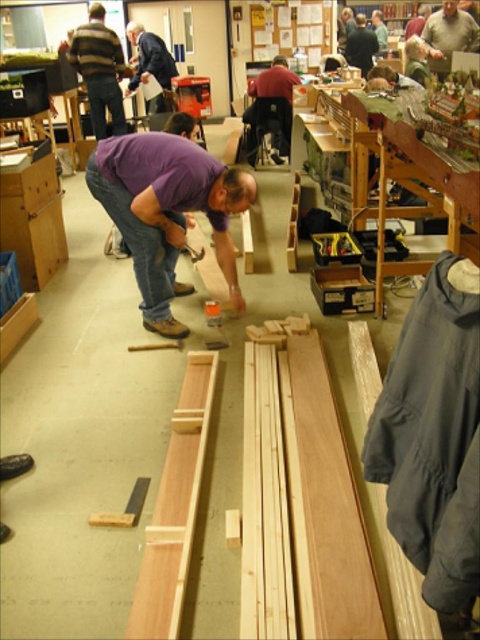
Question: Which of the following is the farthest from the observer?

Choices:
 (A) dark blue shirt at center
 (B) light brown wood at upper right

Answer: (A)

Question: Is blue shirt at center above dark blue shirt at center?

Choices:
 (A) no
 (B) yes

Answer: (A)

Question: Which point appears farthest from the camera in this image?

Choices:
 (A) (264, 83)
 (B) (82, 24)
 (C) (164, 64)

Answer: (B)

Question: Is the position of striped sweater at upper left less distant than that of dark red shirt at center?

Choices:
 (A) no
 (B) yes

Answer: (B)

Question: Which of the following is the farthest from the observer?

Choices:
 (A) dark red shirt at center
 (B) light brown wood at upper right
 (C) blue shirt at center

Answer: (C)

Question: Does striped sweater at upper left appear over dark red shirt at center?

Choices:
 (A) yes
 (B) no

Answer: (A)